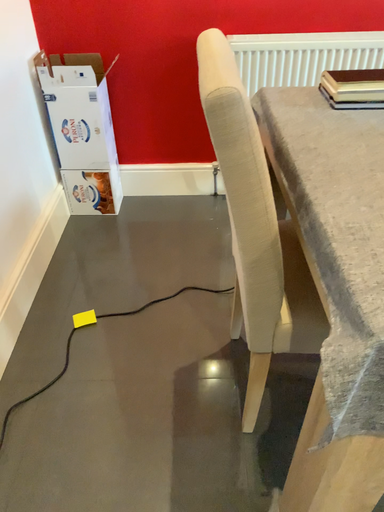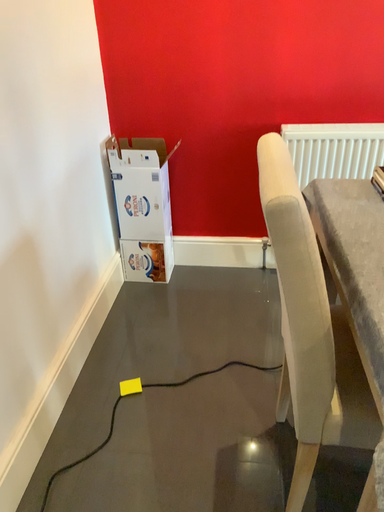
Question: Which way did the camera rotate in the video?

Choices:
 (A) rotated downward
 (B) rotated upward

Answer: (B)